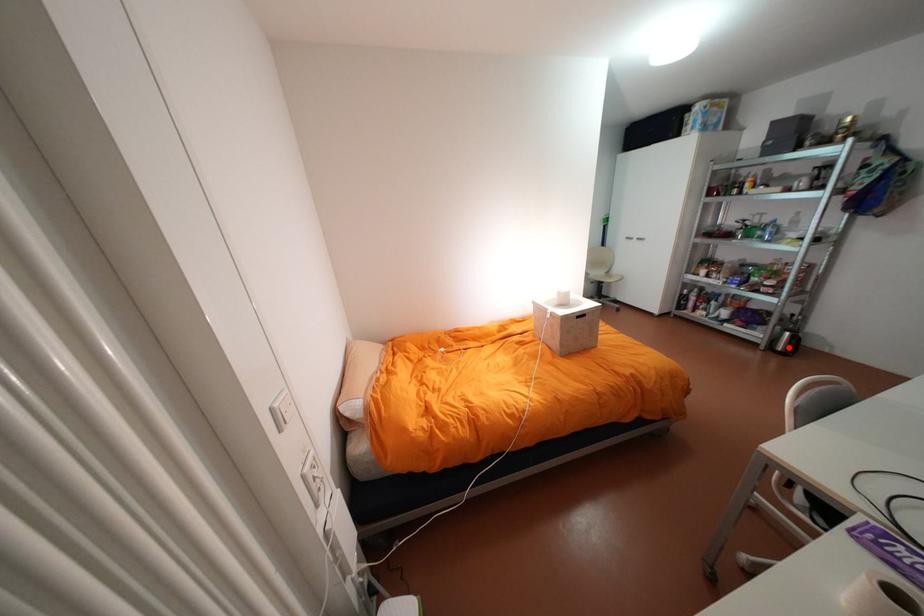
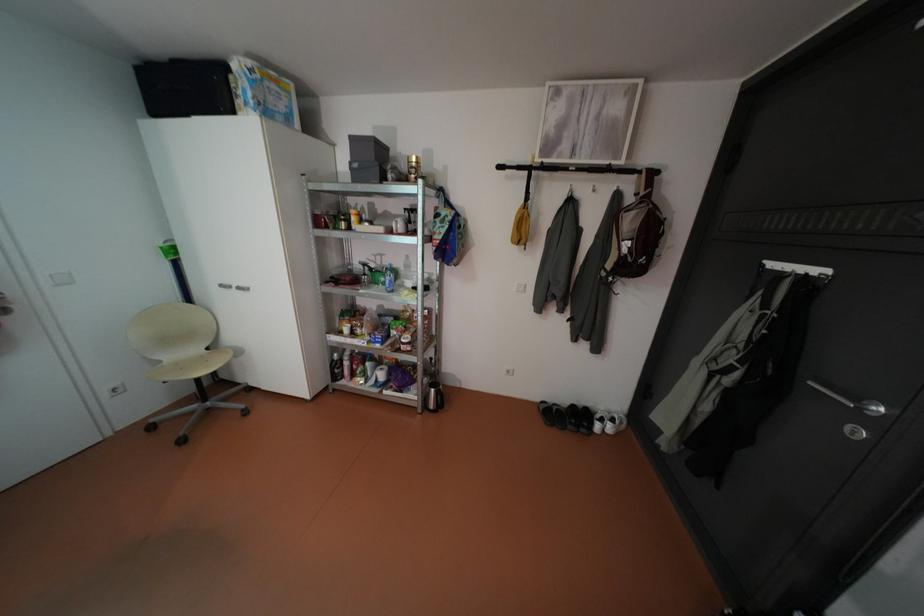
Question: I am providing you with two images of the same scene from different viewpoints. Given a red point in image1, look at the same physical point in image2. Is it:

Choices:
 (A) Closer to the viewpoint
 (B) Farther from the viewpoint

Answer: (B)